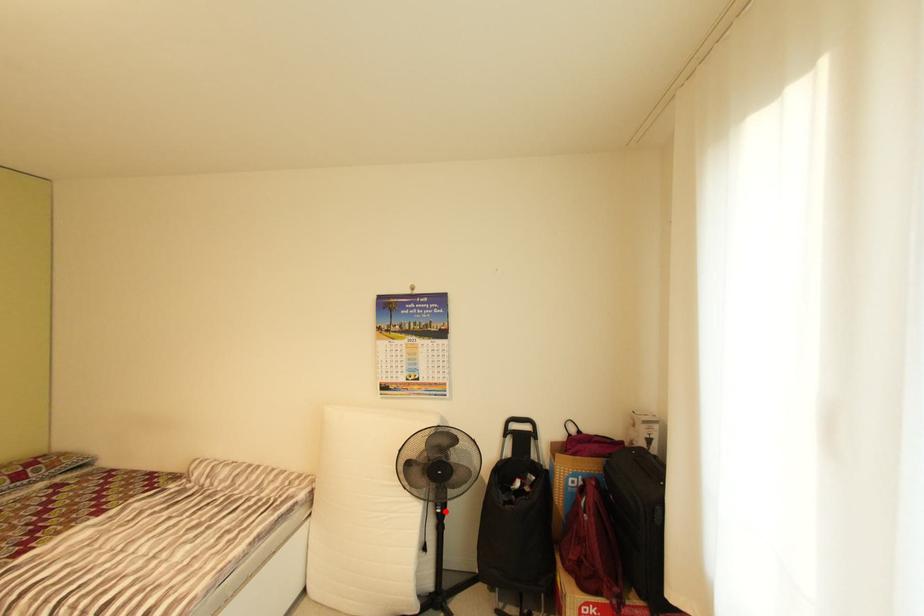
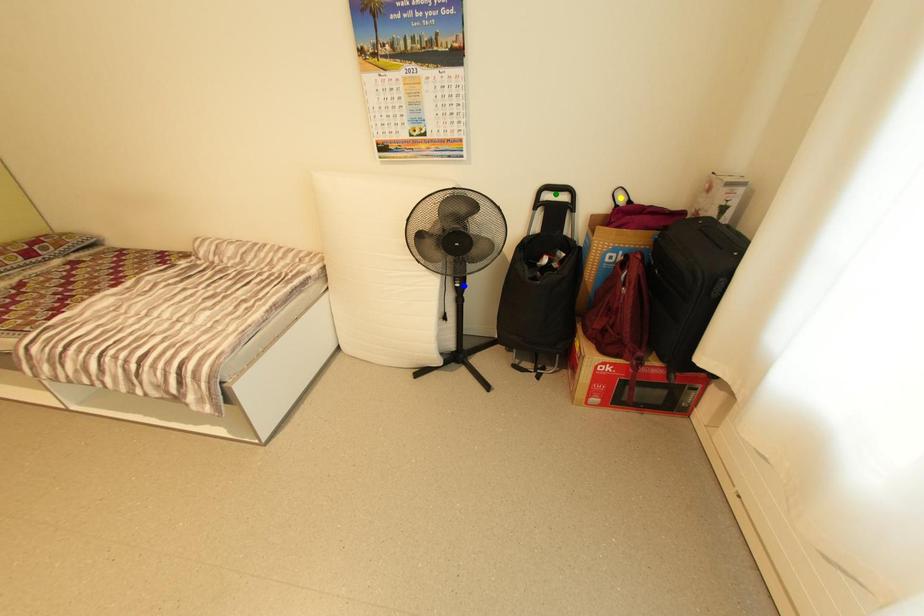
Question: I am providing you with two images of the same scene from different viewpoints. A red point is marked on the first image. You are given multiple points on the second image. Which spot in image 2 lines up with the point in image 1?

Choices:
 (A) blue point
 (B) yellow point
 (C) green point

Answer: (A)